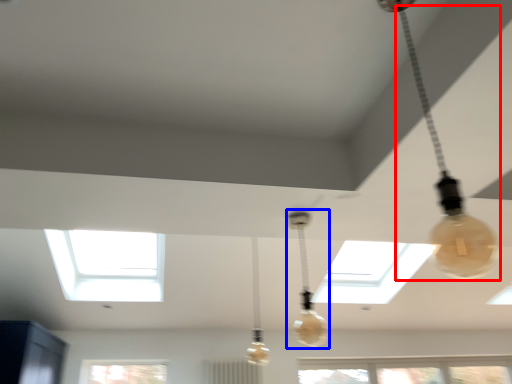
Question: Which object appears farthest to the camera in this image, lamp (highlighted by a red box) or lamp (highlighted by a blue box)?

Choices:
 (A) lamp
 (B) lamp

Answer: (B)